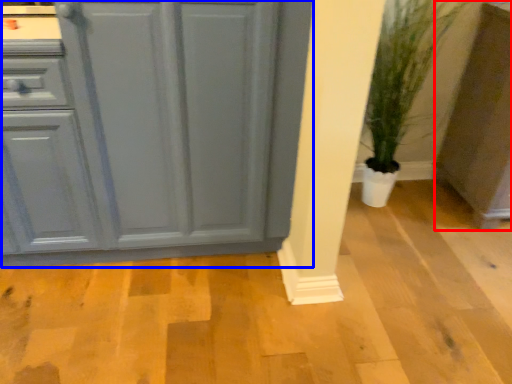
Question: Which object is closer to the camera taking this photo, cabinetry (highlighted by a red box) or cabinetry (highlighted by a blue box)?

Choices:
 (A) cabinetry
 (B) cabinetry

Answer: (B)